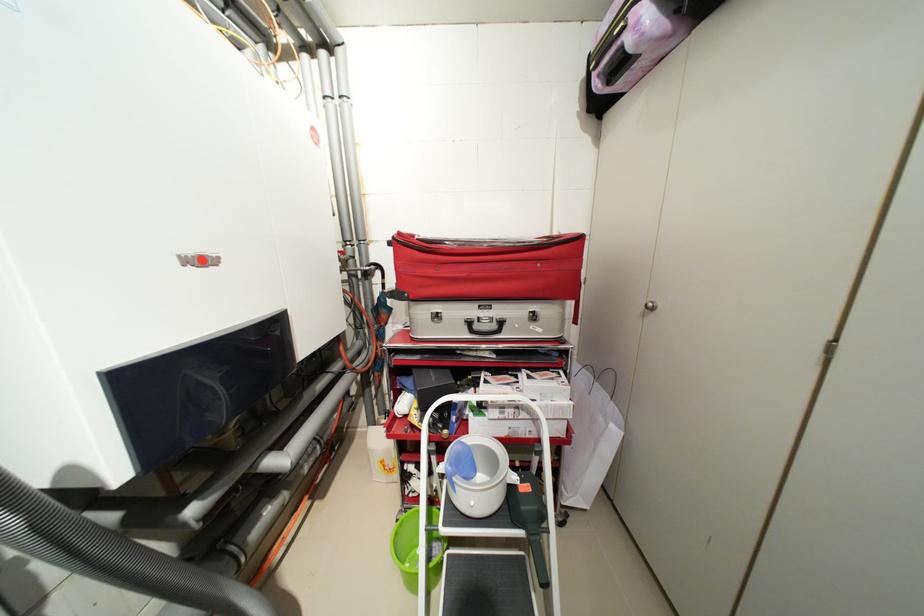
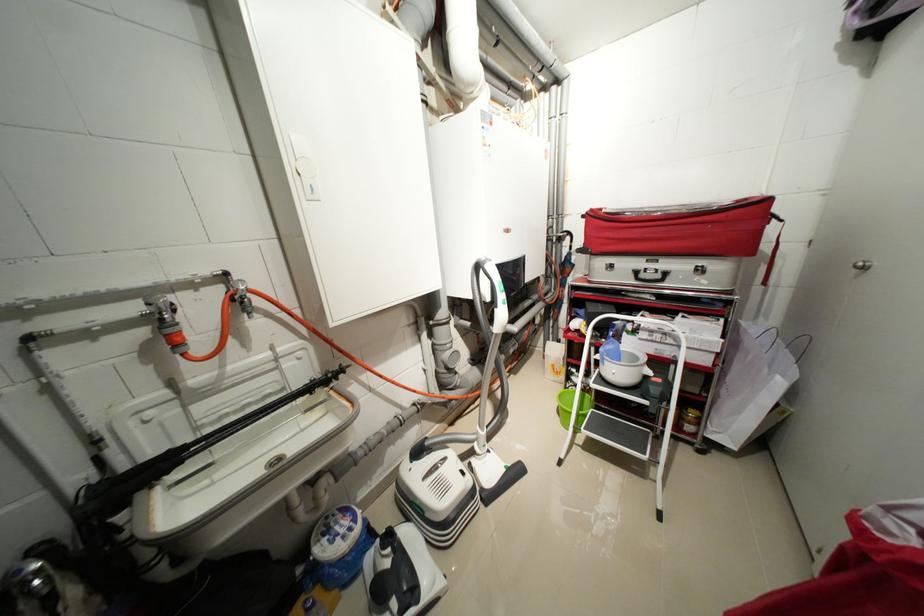
Where in the second image is the point corresponding to [407,235] from the first image?

(599, 211)